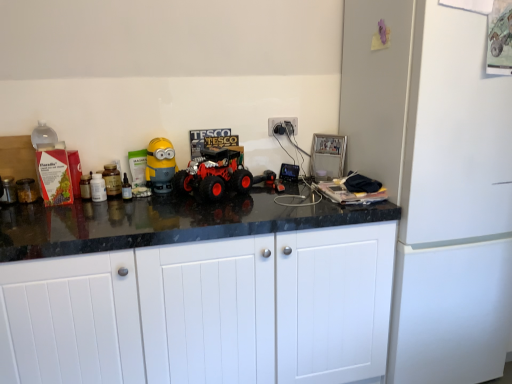
Question: Is white plastic electric outlet at upper right not close to white matte refrigerator at right?

Choices:
 (A) yes
 (B) no

Answer: (B)

Question: Is white plastic electric outlet at upper right positioned in front of white matte refrigerator at right?

Choices:
 (A) no
 (B) yes

Answer: (A)

Question: From a real-world perspective, is white plastic electric outlet at upper right beneath white matte refrigerator at right?

Choices:
 (A) yes
 (B) no

Answer: (B)

Question: Considering the relative sizes of white plastic electric outlet at upper right and white matte refrigerator at right in the image provided, is white plastic electric outlet at upper right wider than white matte refrigerator at right?

Choices:
 (A) no
 (B) yes

Answer: (A)

Question: Can you confirm if white plastic electric outlet at upper right is shorter than white matte refrigerator at right?

Choices:
 (A) yes
 (B) no

Answer: (A)

Question: From a real-world perspective, relative to yellow matte toy at center, which is the 1th toy in left-to-right order, is translucent plastic bottle at center vertically above or below?

Choices:
 (A) above
 (B) below

Answer: (B)

Question: From the image's perspective, is translucent plastic bottle at center located above or below yellow matte toy at center, the second toy positioned from the right?

Choices:
 (A) above
 (B) below

Answer: (B)

Question: In terms of width, does translucent plastic bottle at center look wider or thinner when compared to yellow matte toy at center, which is the 1th toy in left-to-right order?

Choices:
 (A) thin
 (B) wide

Answer: (A)

Question: Is point (124, 175) positioned closer to the camera than point (150, 185)?

Choices:
 (A) closer
 (B) farther

Answer: (B)

Question: Looking at the image, does white matte cabinet doors at center seem bigger or smaller compared to white matte refrigerator at right?

Choices:
 (A) big
 (B) small

Answer: (A)

Question: Is white matte cabinet doors at center wider or thinner than white matte refrigerator at right?

Choices:
 (A) wide
 (B) thin

Answer: (B)

Question: Considering the positions of point (212, 344) and point (473, 220), is point (212, 344) closer or farther from the camera than point (473, 220)?

Choices:
 (A) closer
 (B) farther

Answer: (A)

Question: Considering their positions, is white matte cabinet doors at center located in front of or behind white matte refrigerator at right?

Choices:
 (A) front
 (B) behind

Answer: (A)

Question: Is rubberized black toy truck at center, which ranks as the second toy in left-to-right order, taller or shorter than white matte cabinet doors at center?

Choices:
 (A) tall
 (B) short

Answer: (B)

Question: Relative to white matte cabinet doors at center, is rubberized black toy truck at center, which ranks as the second toy in left-to-right order, in front or behind?

Choices:
 (A) front
 (B) behind

Answer: (B)